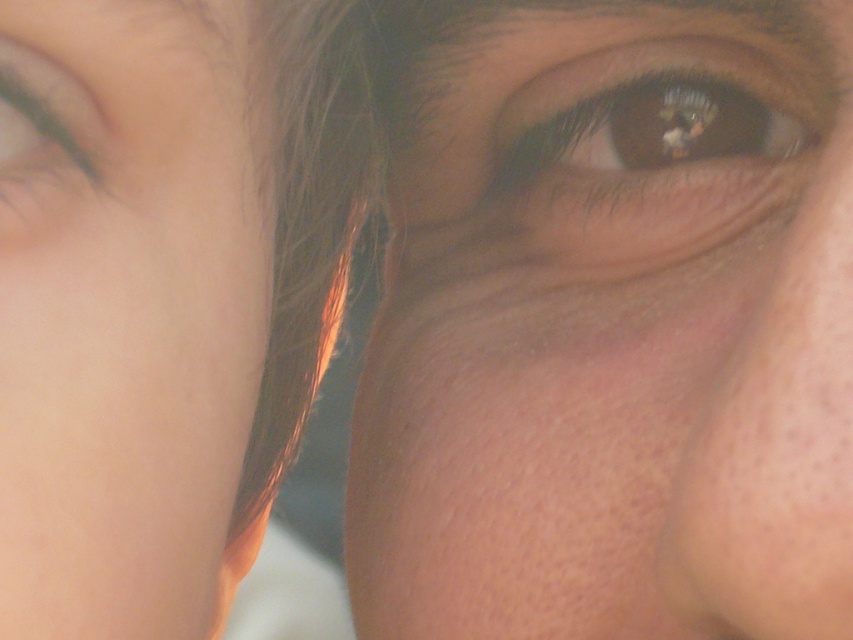
Identify the location of smooth skin eye at center. The image size is (853, 640). (608, 323).

Who is shorter, smooth skin eye at center or smooth skin at left?

With less height is smooth skin at left.

Does point (401, 44) lie in front of point (148, 179)?

No, (401, 44) is behind (148, 179).

Locate an element on the screen. The image size is (853, 640). smooth skin eye at center is located at coordinates (608, 323).

Describe the element at coordinates (608, 323) in the screenshot. I see `smooth skin eye at center` at that location.

Which is more to the left, smooth skin eye at center or brown matte eye at upper left?

Positioned to the left is brown matte eye at upper left.

This screenshot has height=640, width=853. What are the coordinates of `smooth skin eye at center` in the screenshot? It's located at (608, 323).

Does point (0, 573) lie in front of point (616, 195)?

Yes, it is in front of point (616, 195).

Can you confirm if smooth skin at left is smaller than brown matte eye at upper center?

No, smooth skin at left is not smaller than brown matte eye at upper center.

Who is more distant from viewer, (x=149, y=477) or (x=659, y=166)?

Positioned behind is point (x=659, y=166).

In order to click on smooth skin at left in this screenshot , I will do `click(126, 312)`.